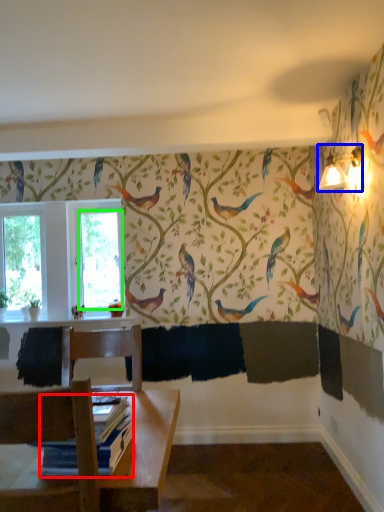
Question: Which object is positioned closest to book (highlighted by a red box)? Select from light fixture (highlighted by a blue box) and window screen (highlighted by a green box).

Choices:
 (A) light fixture
 (B) window screen

Answer: (A)